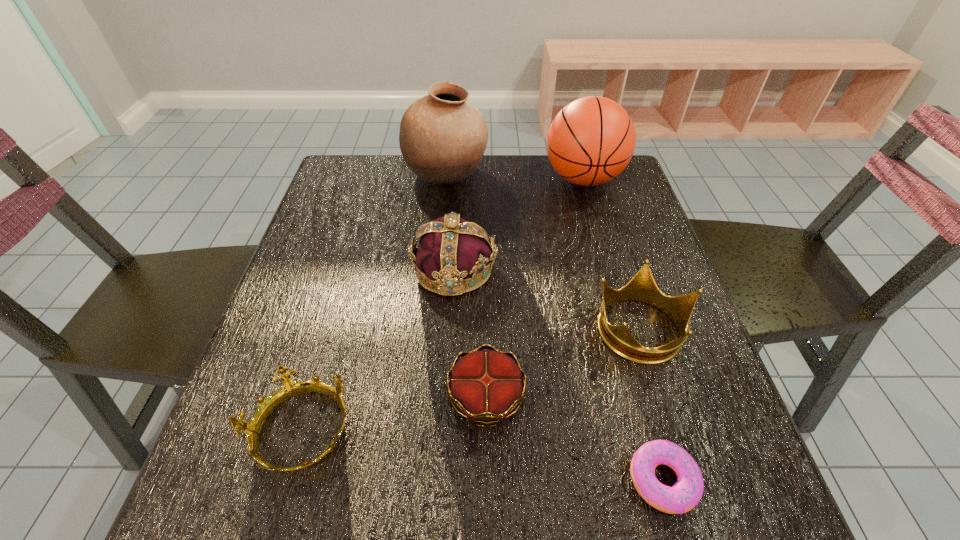
Where is `free space between the rightmost crown and the shortest object`? free space between the rightmost crown and the shortest object is located at coordinates (652, 404).

Image resolution: width=960 pixels, height=540 pixels. What are the coordinates of `unoccupied area between the tallest crown and the rightmost crown` in the screenshot? It's located at (547, 299).

This screenshot has width=960, height=540. Find the location of `vacant space that is in between the second tallest crown and the tallest crown`. vacant space that is in between the second tallest crown and the tallest crown is located at coordinates (547, 299).

Image resolution: width=960 pixels, height=540 pixels. Find the location of `free spot between the tallest crown and the doughnut`. free spot between the tallest crown and the doughnut is located at coordinates (559, 374).

Where is `empty space that is in between the doughnut and the leftmost crown`? The width and height of the screenshot is (960, 540). empty space that is in between the doughnut and the leftmost crown is located at coordinates (482, 455).

Identify which object is located as the second nearest to the rightmost crown. Please provide its 2D coordinates. Your answer should be formatted as a tuple, i.e. [(x, y)], where the tuple contains the x and y coordinates of a point satisfying the conditions above.

[(487, 387)]

Identify which object is located as the third nearest to the pottery. Please provide its 2D coordinates. Your answer should be formatted as a tuple, i.e. [(x, y)], where the tuple contains the x and y coordinates of a point satisfying the conditions above.

[(642, 287)]

Choose which crown is the nearest neighbor to the doughnut. Please provide its 2D coordinates. Your answer should be formatted as a tuple, i.e. [(x, y)], where the tuple contains the x and y coordinates of a point satisfying the conditions above.

[(642, 287)]

Image resolution: width=960 pixels, height=540 pixels. In order to click on crown that is the closest to the pottery in this screenshot , I will do `click(451, 250)`.

This screenshot has height=540, width=960. In order to click on free region that satisfies the following two spatial constraints: 1. on the back side of the basketball; 2. on the right side of the tallest crown in this screenshot , I will do `click(459, 179)`.